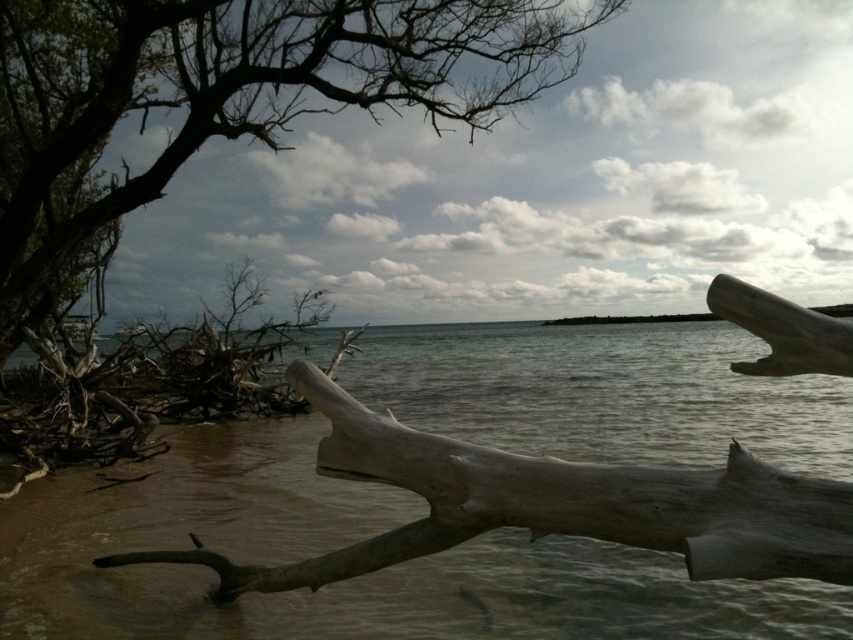
Question: Which of the following is the closest to the observer?

Choices:
 (A) clear water at center
 (B) dark brown bark tree at upper left

Answer: (A)

Question: Is the position of clear water at center more distant than that of dark brown bark tree at upper left?

Choices:
 (A) yes
 (B) no

Answer: (B)

Question: Is clear water at center below dark brown bark tree at upper left?

Choices:
 (A) no
 (B) yes

Answer: (B)

Question: Which point appears closest to the camera in this image?

Choices:
 (A) (62, 99)
 (B) (96, 582)

Answer: (B)

Question: Does clear water at center have a smaller size compared to dark brown bark tree at upper left?

Choices:
 (A) no
 (B) yes

Answer: (A)